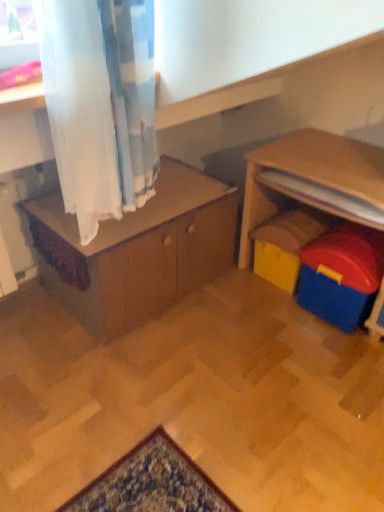
Question: From a real-world perspective, is blue plastic toy at right, which ranks as the 1th toy in front-to-back order, below wooden cabinet at center?

Choices:
 (A) yes
 (B) no

Answer: (A)

Question: Is the depth of blue plastic toy at right, the second toy when ordered from back to front, greater than that of wooden cabinet at center?

Choices:
 (A) yes
 (B) no

Answer: (A)

Question: Is blue plastic toy at right, which ranks as the 1th toy in front-to-back order, positioned with its back to wooden cabinet at center?

Choices:
 (A) yes
 (B) no

Answer: (B)

Question: Are blue plastic toy at right, the second toy when ordered from back to front, and wooden cabinet at center located far from each other?

Choices:
 (A) yes
 (B) no

Answer: (B)

Question: Can you confirm if blue plastic toy at right, which ranks as the 1th toy in front-to-back order, is thinner than wooden cabinet at center?

Choices:
 (A) yes
 (B) no

Answer: (A)

Question: Is blue plastic toy at right, the second toy when ordered from back to front, in contact with wooden cabinet at center?

Choices:
 (A) no
 (B) yes

Answer: (A)

Question: Could blue plastic toy at right, the second toy when ordered from back to front, be considered to be inside yellow plastic toy at lower right, which appears as the 1th toy when viewed from the back?

Choices:
 (A) yes
 (B) no

Answer: (B)

Question: Can you confirm if yellow plastic toy at lower right, the second toy in the front-to-back sequence, is smaller than blue plastic toy at right, the second toy when ordered from back to front?

Choices:
 (A) yes
 (B) no

Answer: (A)

Question: Is yellow plastic toy at lower right, which appears as the 1th toy when viewed from the back, in front of blue plastic toy at right, which ranks as the 1th toy in front-to-back order?

Choices:
 (A) yes
 (B) no

Answer: (B)

Question: From a real-world perspective, is yellow plastic toy at lower right, which appears as the 1th toy when viewed from the back, positioned over blue plastic toy at right, which ranks as the 1th toy in front-to-back order, based on gravity?

Choices:
 (A) yes
 (B) no

Answer: (B)

Question: Does yellow plastic toy at lower right, the second toy in the front-to-back sequence, turn towards blue plastic toy at right, which ranks as the 1th toy in front-to-back order?

Choices:
 (A) no
 (B) yes

Answer: (A)

Question: Is yellow plastic toy at lower right, which appears as the 1th toy when viewed from the back, positioned behind blue plastic toy at right, which ranks as the 1th toy in front-to-back order?

Choices:
 (A) no
 (B) yes

Answer: (B)

Question: Is yellow plastic toy at lower right, which appears as the 1th toy when viewed from the back, in front of wooden cabinet at center?

Choices:
 (A) yes
 (B) no

Answer: (B)